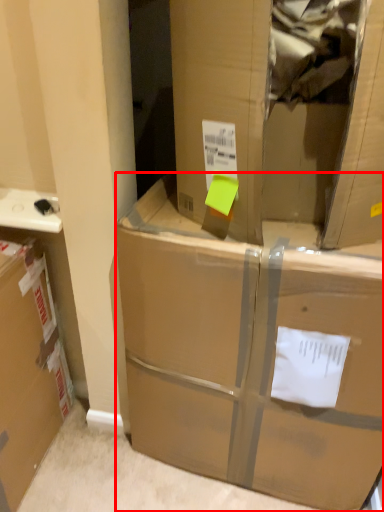
Question: From the image's perspective, considering the relative positions of box (annotated by the red box) and cardboard box in the image provided, where is box (annotated by the red box) located with respect to the staircase?

Choices:
 (A) above
 (B) below

Answer: (B)